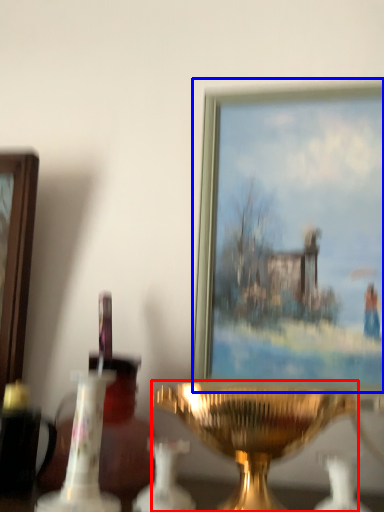
Question: Which object appears closest to the camera in this image, candle holder (highlighted by a red box) or picture frame (highlighted by a blue box)?

Choices:
 (A) candle holder
 (B) picture frame

Answer: (A)